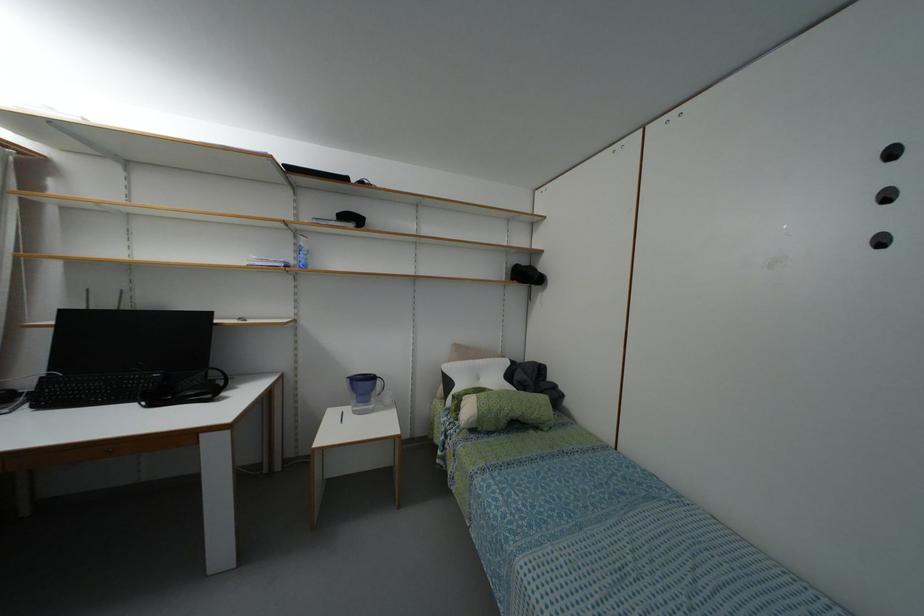
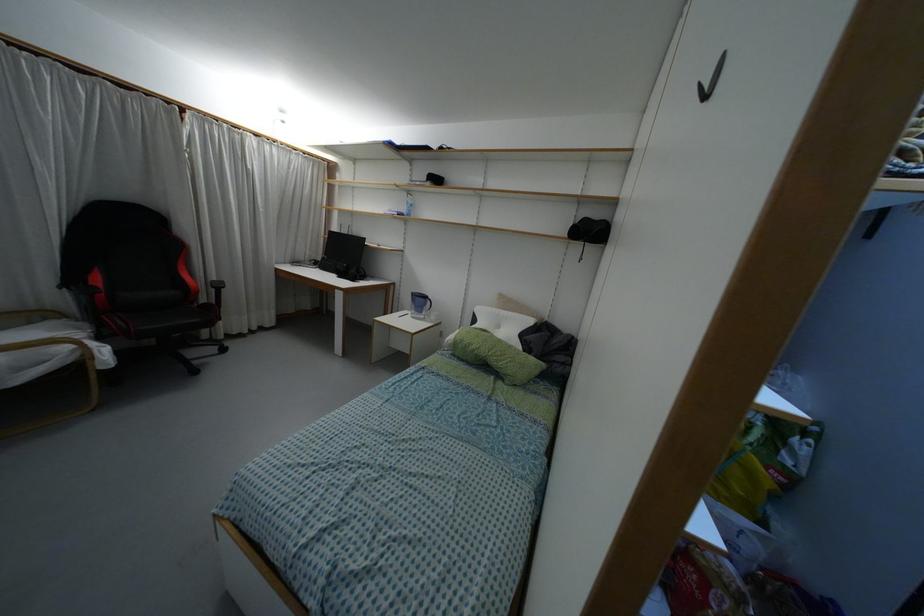
Where in the second image is the point corresponding to pixel 296 233 from the first image?

(407, 192)